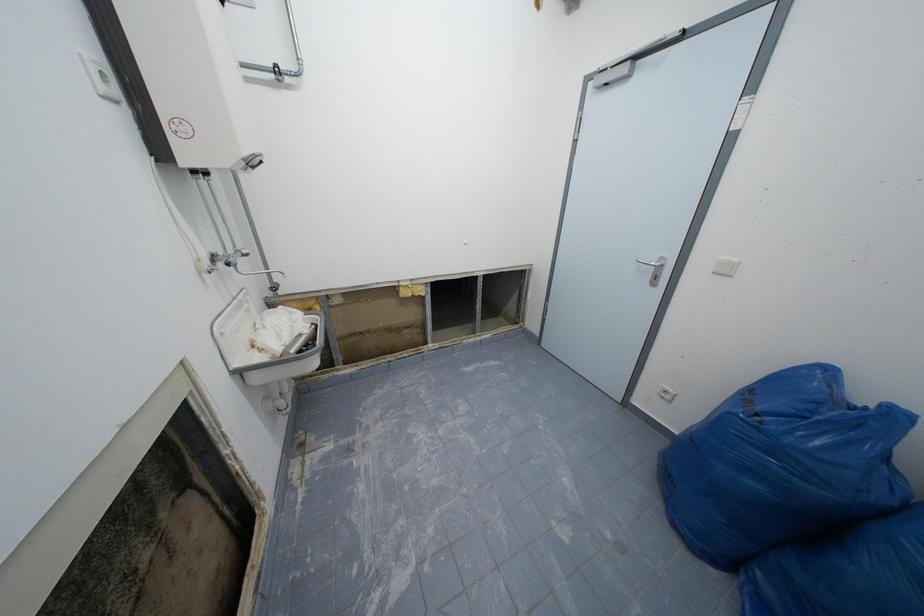
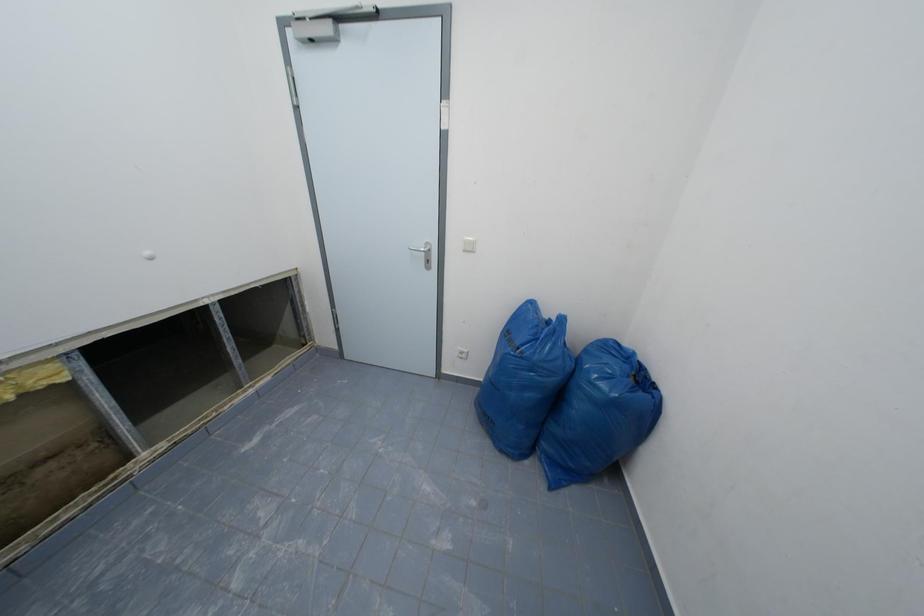
Question: The camera is either moving clockwise (left) or counter-clockwise (right) around the object. The first image is from the beginning of the video and the second image is from the end. Is the camera moving left or right when shooting the video?

Choices:
 (A) Left
 (B) Right

Answer: (A)